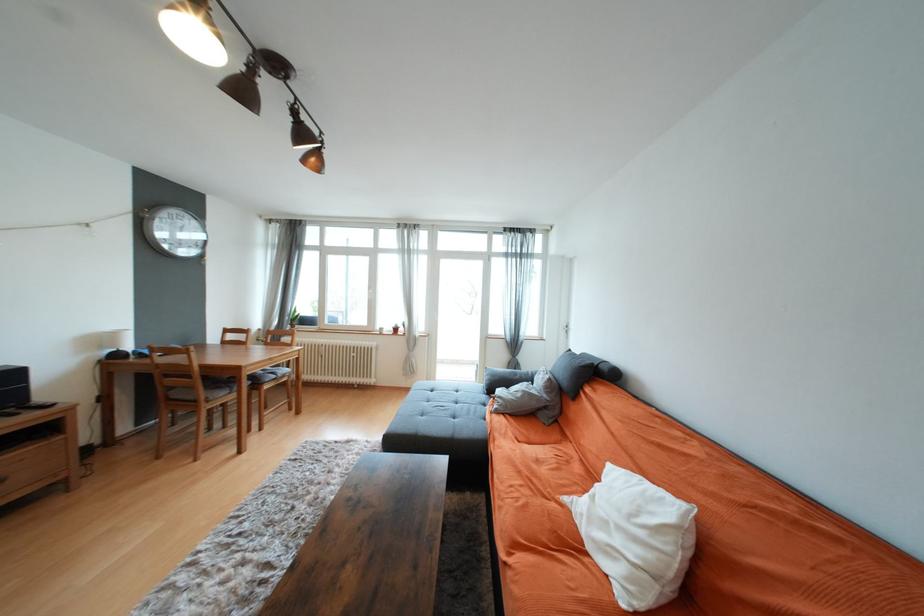
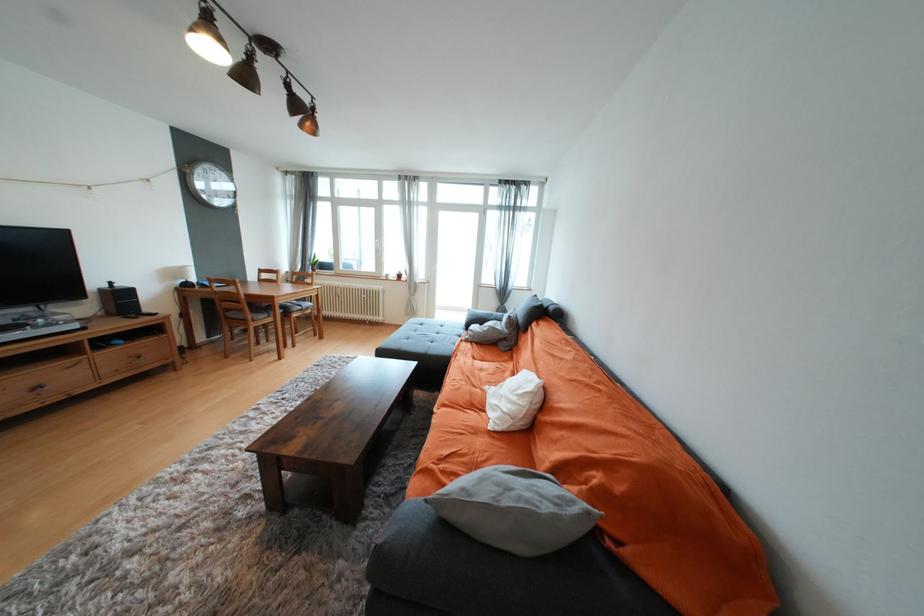
Find the pixel in the second image that matches (525,395) in the first image.

(492, 330)